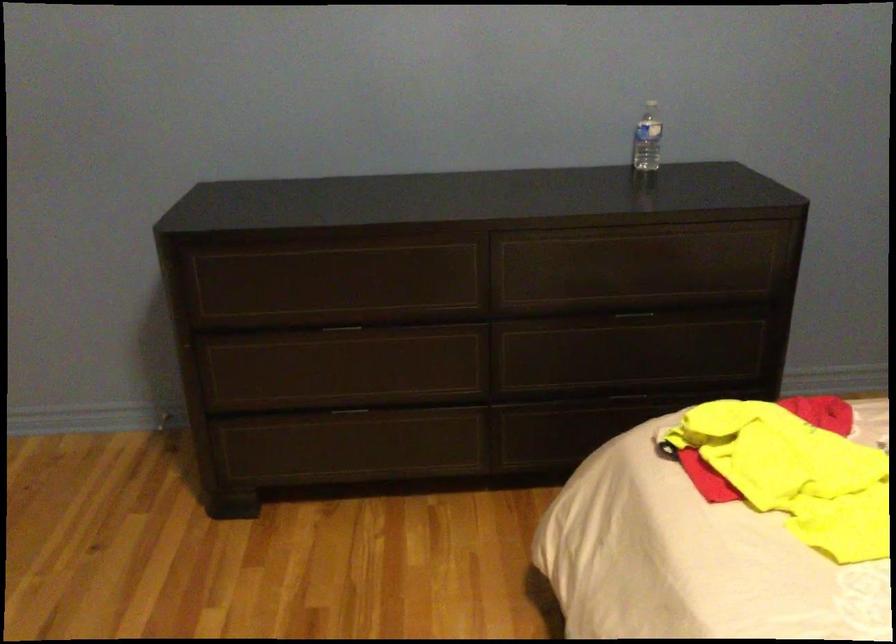
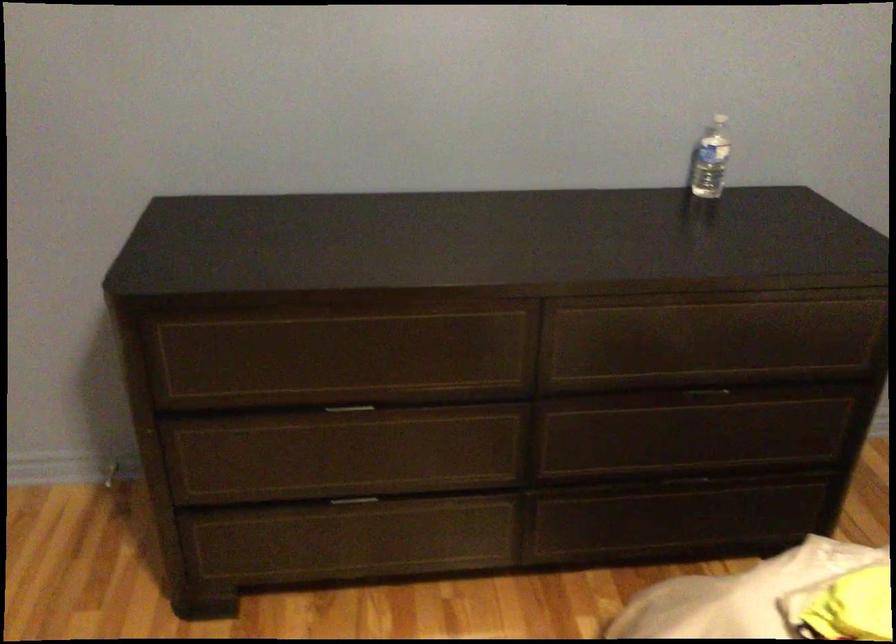
What movement of the cameraman would produce the second image?

The movement direction of the cameraman is left, forward.